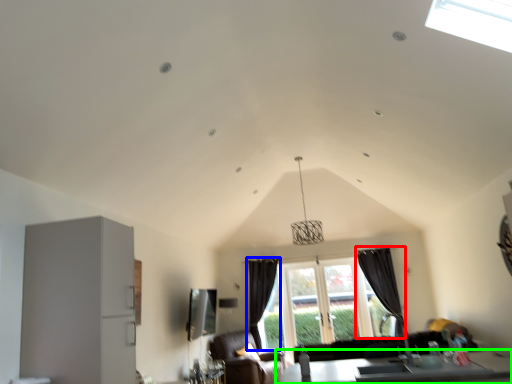
Question: Based on their relative distances, which object is farther from curtain (highlighted by a red box)? Choose from curtain (highlighted by a blue box) and table (highlighted by a green box).

Choices:
 (A) curtain
 (B) table

Answer: (B)